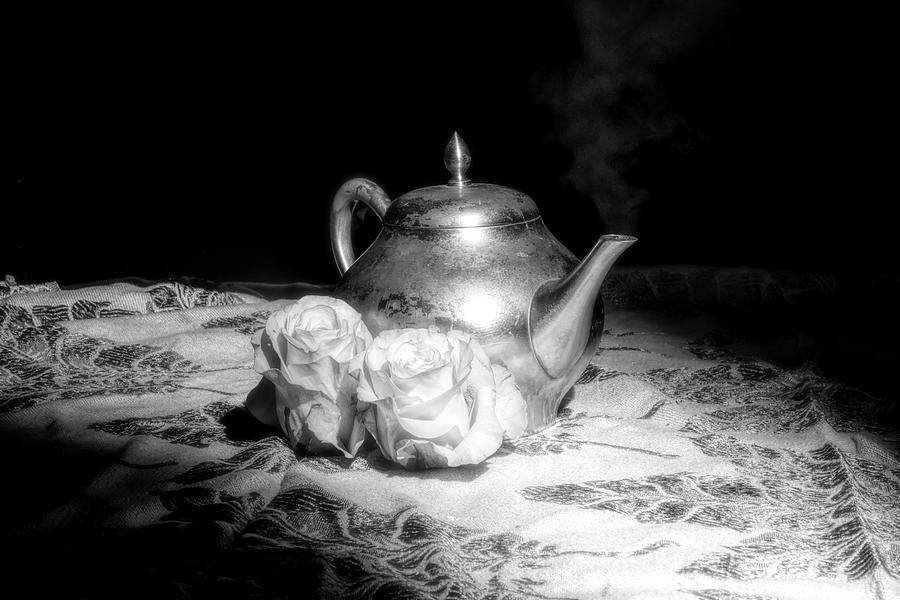
You are a GUI agent. You are given a task and a screenshot of the screen. Output one action in this format:
    pyautogui.click(x=<x>, y=<y>)
    Task: Click on the base of teapot
    This screenshot has height=600, width=900.
    Given the screenshot: What is the action you would take?
    pyautogui.click(x=545, y=426)